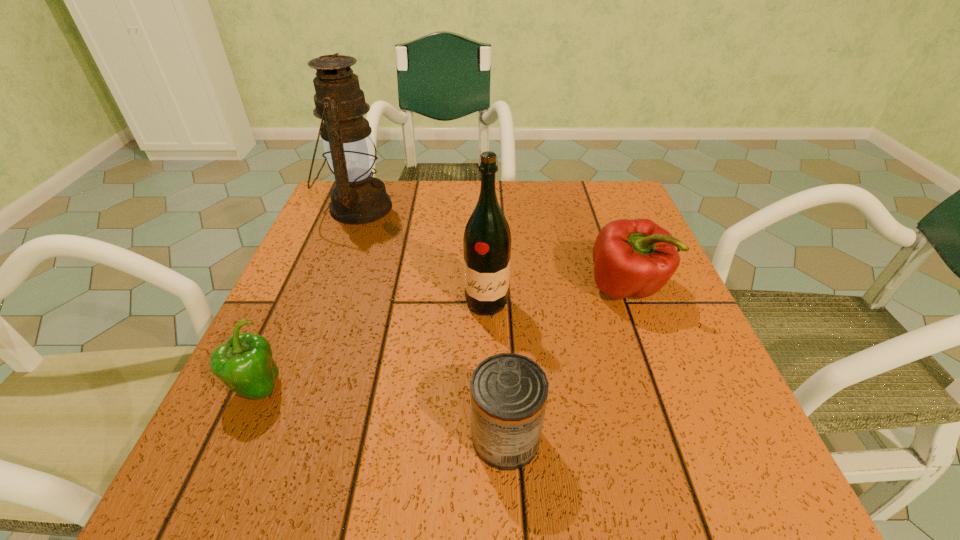
Locate an element on the screen. The image size is (960, 540). vacant space at the right edge of the desktop is located at coordinates (660, 372).

The height and width of the screenshot is (540, 960). I want to click on vacant position at the far right corner of the desktop, so click(x=613, y=208).

Where is `vacant space that is in between the left bell pepper and the can`? The image size is (960, 540). vacant space that is in between the left bell pepper and the can is located at coordinates (381, 413).

This screenshot has height=540, width=960. What are the coordinates of `unoccupied position between the rightmost object and the nearer bell pepper` in the screenshot? It's located at (442, 339).

Image resolution: width=960 pixels, height=540 pixels. Find the location of `free space between the nearer bell pepper and the can`. free space between the nearer bell pepper and the can is located at coordinates (381, 413).

Where is `free space between the farthest object and the second tallest object`? This screenshot has height=540, width=960. free space between the farthest object and the second tallest object is located at coordinates (422, 255).

Image resolution: width=960 pixels, height=540 pixels. Identify the location of empty location between the can and the left bell pepper. (381, 413).

At what (x,y) coordinates should I click in order to perform the action: click on free space between the nearer bell pepper and the oil lamp. Please return your answer as a coordinate pair (x, y). Image resolution: width=960 pixels, height=540 pixels. Looking at the image, I should click on (307, 298).

The width and height of the screenshot is (960, 540). What are the coordinates of `free space between the can and the oil lamp` in the screenshot? It's located at (432, 322).

Locate an element on the screen. The width and height of the screenshot is (960, 540). the second closest object to the fourth shortest object is located at coordinates (509, 392).